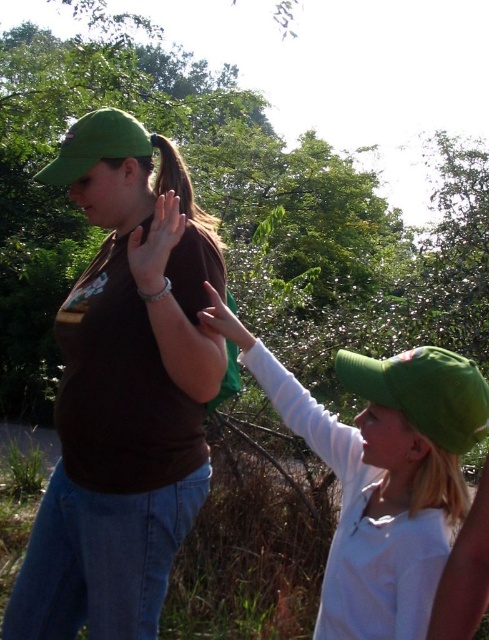
You are a photographer trying to capture a closeup shot of the brown matte shirt at center and the matte brown hand at center. Since the camera can only focus on one object at a time, which object should you focus on to ensure it appears clearer in the photo?

The brown matte shirt at center is larger in size than the matte brown hand at center, so focusing on the brown matte shirt at center will ensure it appears clearer in the photo.

You are designing a new app that requires understanding spatial relationships between clothing and body parts. Given the scene described, can you determine if the brown matte shirt at center is wider than the matte brown hand at center?

The brown matte shirt at center is wider than the matte brown hand at center according to the description.

Consider the image. You are a photographer trying to capture a candid shot of the two people in the scene. You want to ensure that the brown matte shirt at center and the matte brown hand at upper center are both clearly visible in the frame. Based on their positions, is the hand likely obscuring the shirt in any way?

The brown matte shirt at center is located below the matte brown hand at upper center, so the hand is above the shirt. Since the hand is positioned higher up, it is unlikely to be obscuring the shirt in the image.